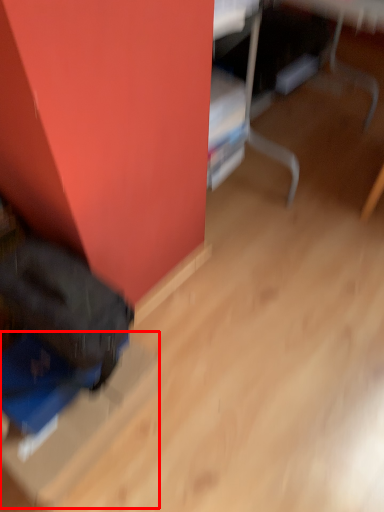
Question: Where is cardboard box (annotated by the red box) located in relation to furniture in the image?

Choices:
 (A) right
 (B) left

Answer: (B)